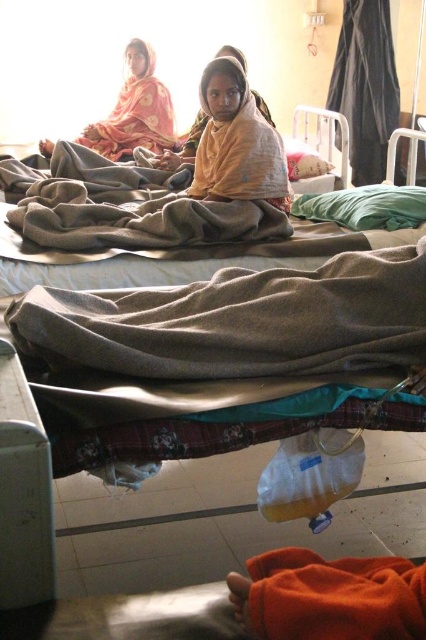
You are a nurse in the hospital ward and need to locate two specific points in the room. The first point is at coordinate point (204, 157) and the second is at point (118, 93). Which point is closer to you?

Point (204, 157) is closer to the viewer than point (118, 93).

You are a nurse preparing to organize supplies in the hospital ward. You need to place both the yellow fabric at center and the matte orange shawl at upper left on a shelf that can only hold items with widths less than 1 meter. Which item should you place first to ensure both fit?

The yellow fabric at center has a lesser width compared to matte orange shawl at upper left, so you should place the matte orange shawl at upper left first to ensure both items fit on the shelf.

You are a nurse preparing to cover a patient with either the gray woolen blanket at center or the yellow fabric at center. Which item has a larger width to provide better coverage?

The gray woolen blanket at center might be wider than yellow fabric at center, so it could provide better coverage.